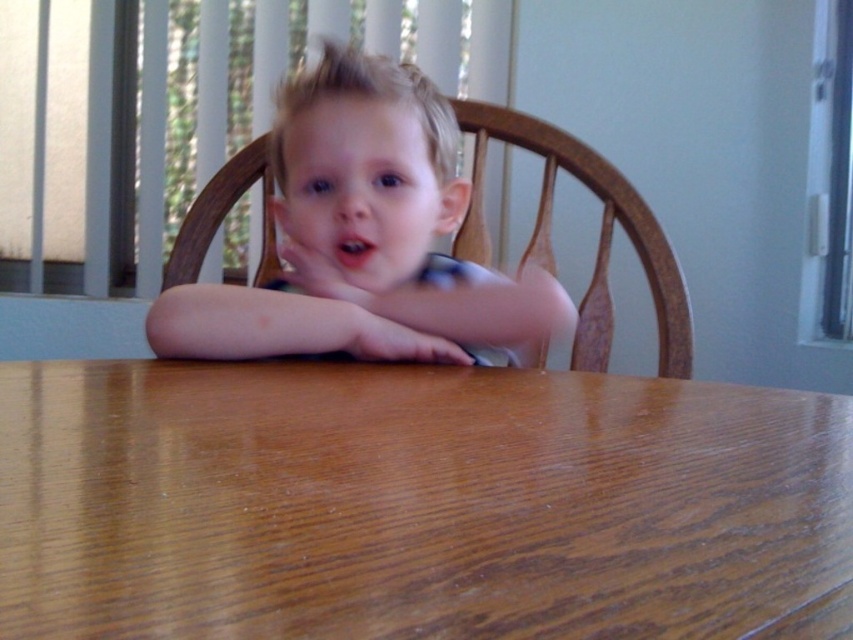
You are a parent trying to set up a play area for your child. The brown wood table at center is where the child will sit. Considering the smooth blonde hair at center, is the table height appropriate for the child?

The brown wood table at center has a lesser height compared to smooth blonde hair at center, which suggests the table is lower than the child. This may mean the table is appropriately sized for the child, as it allows them to sit comfortably without straining their posture.